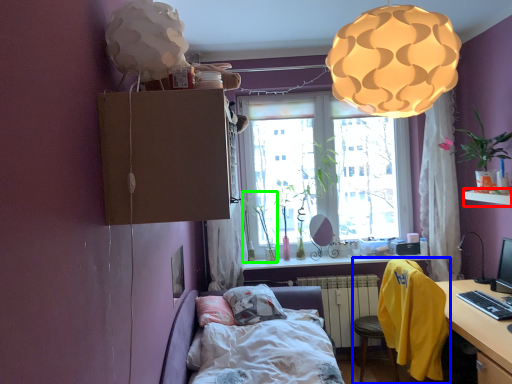
Question: Which object is the closest to the window sill (highlighted by a red box)? Choose among these: chair (highlighted by a blue box) or plant (highlighted by a green box).

Choices:
 (A) chair
 (B) plant

Answer: (A)